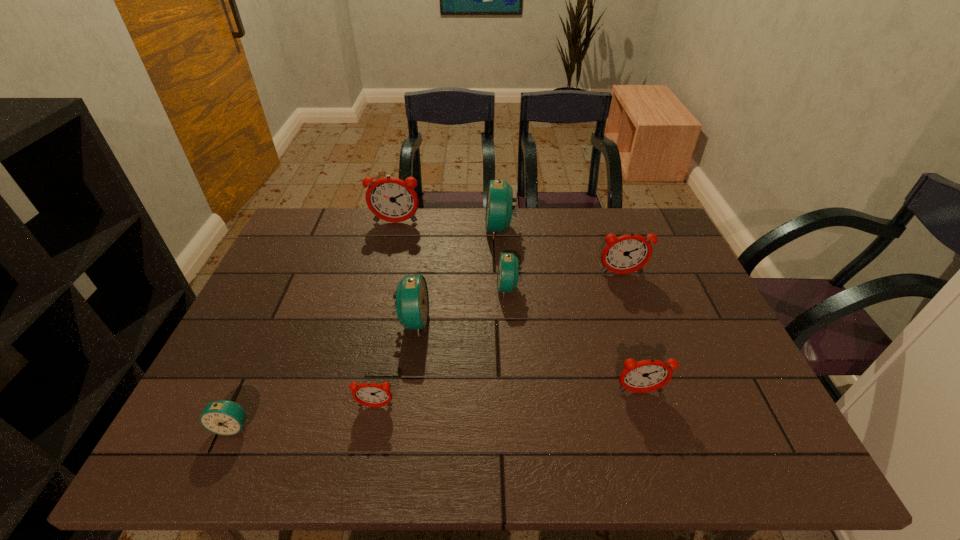
The height and width of the screenshot is (540, 960). I want to click on the nearest object, so click(223, 417).

In order to click on the leftmost blue alarm clock in this screenshot , I will do `click(223, 417)`.

Identify the location of blank space located 0.280m on the front-facing side of the farthest blue alarm clock. This screenshot has height=540, width=960. (401, 228).

Identify the location of free space located 0.210m on the front-facing side of the farthest blue alarm clock. (422, 228).

The height and width of the screenshot is (540, 960). Find the location of `vacant region located 0.370m on the front-facing side of the farthest blue alarm clock`. vacant region located 0.370m on the front-facing side of the farthest blue alarm clock is located at coordinates (374, 228).

Where is `vacant area located on the front-facing side of the farthest reddish-pink alarm clock`? vacant area located on the front-facing side of the farthest reddish-pink alarm clock is located at coordinates (391, 242).

I want to click on free space located 0.360m on the front-facing side of the third blue alarm clock from right to left, so click(565, 321).

Where is `vacant space located 0.230m on the front-facing side of the second biggest reddish-pink alarm clock`? vacant space located 0.230m on the front-facing side of the second biggest reddish-pink alarm clock is located at coordinates (644, 338).

The height and width of the screenshot is (540, 960). I want to click on vacant space located on the front-facing side of the third biggest blue alarm clock, so click(x=406, y=288).

At what (x,y) coordinates should I click in order to perform the action: click on vacant region located on the front-facing side of the third biggest blue alarm clock. Please return your answer as a coordinate pair (x, y). Looking at the image, I should click on (381, 288).